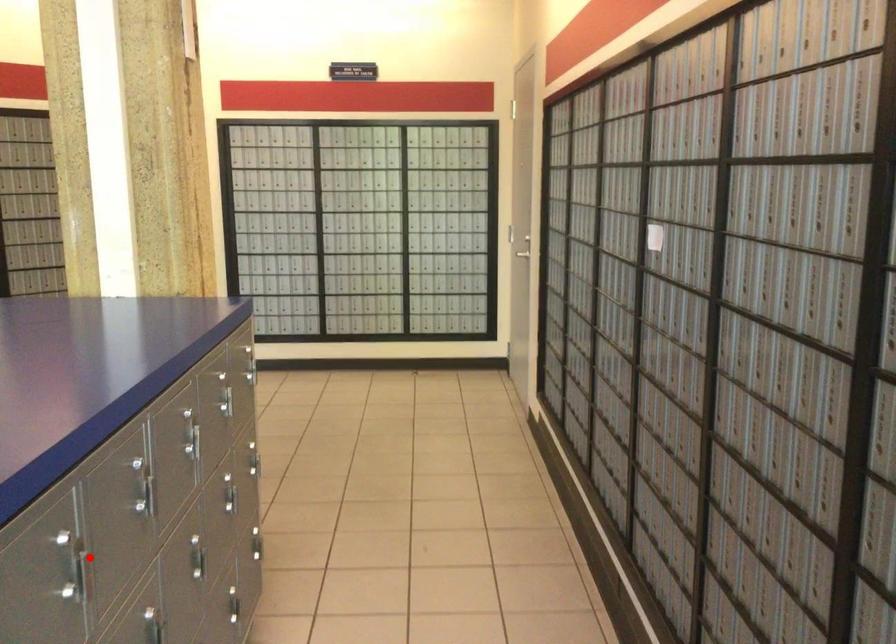
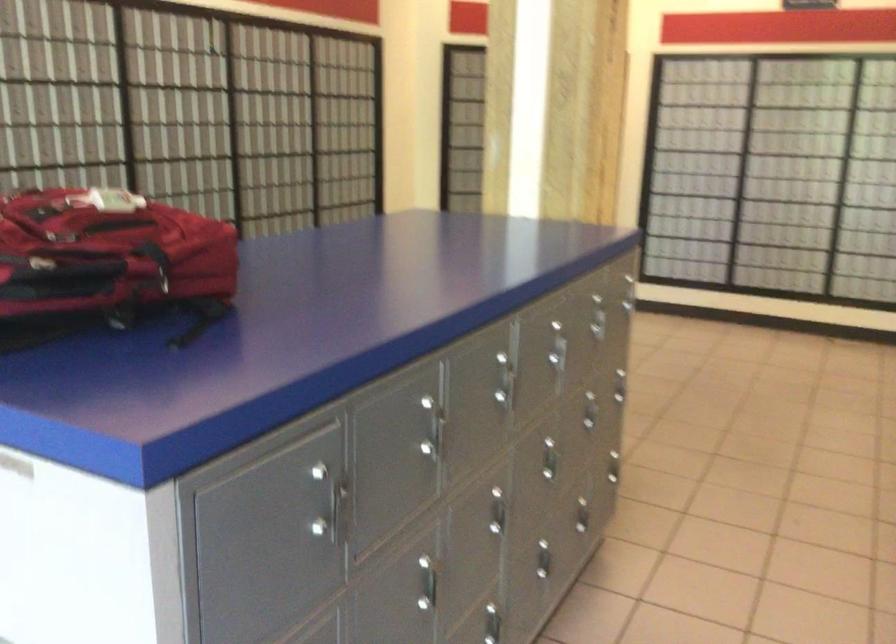
Where in the second image is the point corresponding to the highlighted location from the first image?

(444, 431)